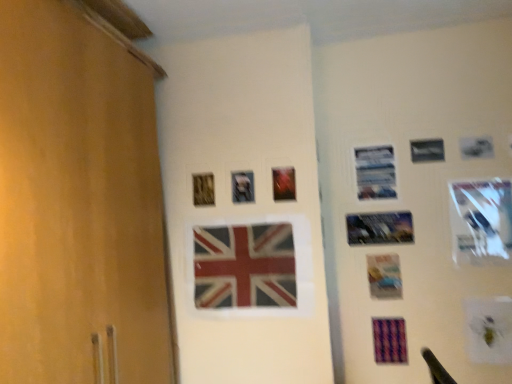
Question: Is metallic silver picture frame at upper right, marked as the 4th picture frame in a right-to-left arrangement, facing away from metallic silver picture frame at upper right, which is counted as the 2th picture frame, starting from the right?

Choices:
 (A) no
 (B) yes

Answer: (A)

Question: Is metallic silver picture frame at upper right, marked as the 4th picture frame in a right-to-left arrangement, bigger than metallic silver picture frame at upper right, which appears as the sixth picture frame when viewed from the left?

Choices:
 (A) no
 (B) yes

Answer: (B)

Question: Considering the relative sizes of metallic silver picture frame at upper right, positioned as the fourth picture frame in left-to-right order, and metallic silver picture frame at upper right, which appears as the sixth picture frame when viewed from the left, in the image provided, is metallic silver picture frame at upper right, positioned as the fourth picture frame in left-to-right order, wider than metallic silver picture frame at upper right, which appears as the sixth picture frame when viewed from the left,?

Choices:
 (A) yes
 (B) no

Answer: (A)

Question: From a real-world perspective, is metallic silver picture frame at upper right, positioned as the fourth picture frame in left-to-right order, physically below metallic silver picture frame at upper right, which appears as the sixth picture frame when viewed from the left?

Choices:
 (A) yes
 (B) no

Answer: (A)

Question: Can you confirm if metallic silver picture frame at upper right, marked as the 4th picture frame in a right-to-left arrangement, is positioned to the right of metallic silver picture frame at upper right, which appears as the sixth picture frame when viewed from the left?

Choices:
 (A) yes
 (B) no

Answer: (B)

Question: From a real-world perspective, is metallic silver picture frame at upper right, marked as the 4th picture frame in a right-to-left arrangement, on metallic silver picture frame at upper right, which is counted as the 2th picture frame, starting from the right?

Choices:
 (A) no
 (B) yes

Answer: (A)

Question: Considering the relative sizes of metallic silver picture frame at upper right, the seventh picture frame in the left-to-right sequence, and metallic reflective photo frame at center-right, which ranks as the third picture frame in right-to-left order, in the image provided, is metallic silver picture frame at upper right, the seventh picture frame in the left-to-right sequence, bigger than metallic reflective photo frame at center-right, which ranks as the third picture frame in right-to-left order,?

Choices:
 (A) no
 (B) yes

Answer: (B)

Question: Are metallic silver picture frame at upper right, the seventh picture frame in the left-to-right sequence, and metallic reflective photo frame at center-right, acting as the 5th picture frame starting from the left, beside each other?

Choices:
 (A) yes
 (B) no

Answer: (B)

Question: Is metallic silver picture frame at upper right, the seventh picture frame in the left-to-right sequence, further to the viewer compared to metallic reflective photo frame at center-right, acting as the 5th picture frame starting from the left?

Choices:
 (A) yes
 (B) no

Answer: (B)

Question: Does metallic silver picture frame at upper right, which is the first picture frame from right to left, have a smaller size compared to metallic reflective photo frame at center-right, acting as the 5th picture frame starting from the left?

Choices:
 (A) no
 (B) yes

Answer: (A)

Question: From a real-world perspective, is metallic silver picture frame at upper right, which is the first picture frame from right to left, located beneath metallic reflective photo frame at center-right, acting as the 5th picture frame starting from the left?

Choices:
 (A) yes
 (B) no

Answer: (A)

Question: Is metallic silver picture frame at upper right, the seventh picture frame in the left-to-right sequence, at the left side of metallic reflective photo frame at center-right, which ranks as the third picture frame in right-to-left order?

Choices:
 (A) yes
 (B) no

Answer: (B)

Question: Can you confirm if metallic silver picture frame at center, placed as the 2th picture frame when sorted from left to right, is bigger than wooden picture frame at upper center, which ranks as the seventh picture frame in right-to-left order?

Choices:
 (A) yes
 (B) no

Answer: (B)